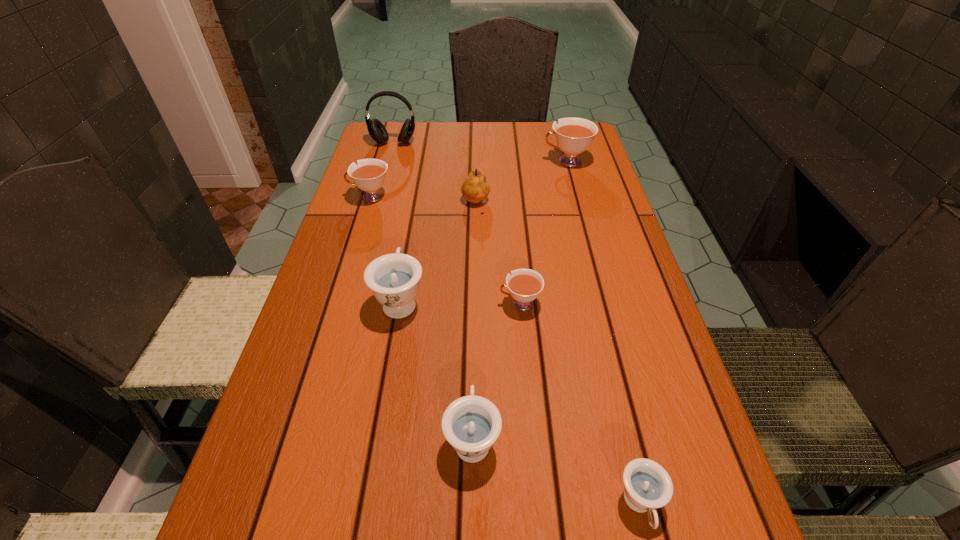
At what (x,y) coordinates should I click in order to perform the action: click on the farthest object. Please return your answer as a coordinate pair (x, y). This screenshot has width=960, height=540. Looking at the image, I should click on (377, 131).

Find the location of a particular element. black headset is located at coordinates (377, 131).

The image size is (960, 540). What are the coordinates of `the seventh nearest object` in the screenshot? It's located at (573, 135).

Locate an element on the screen. The image size is (960, 540). the biggest white teacup is located at coordinates (573, 135).

Locate an element on the screen. The image size is (960, 540). the leftmost blue teacup is located at coordinates (394, 278).

In order to click on the fifth teacup from right to left in this screenshot , I will do `click(394, 278)`.

This screenshot has width=960, height=540. Find the location of `pear`. pear is located at coordinates (475, 188).

You are a GUI agent. You are given a task and a screenshot of the screen. Output one action in this format:
    pyautogui.click(x=<x>, y=<y>)
    Task: Click on the fifth nearest teacup
    This screenshot has width=960, height=540.
    Given the screenshot: What is the action you would take?
    pyautogui.click(x=369, y=176)

Locate an element on the screen. This screenshot has width=960, height=540. the second farthest white teacup is located at coordinates (369, 176).

Identify the location of the third teacup from left to right. The image size is (960, 540). (471, 424).